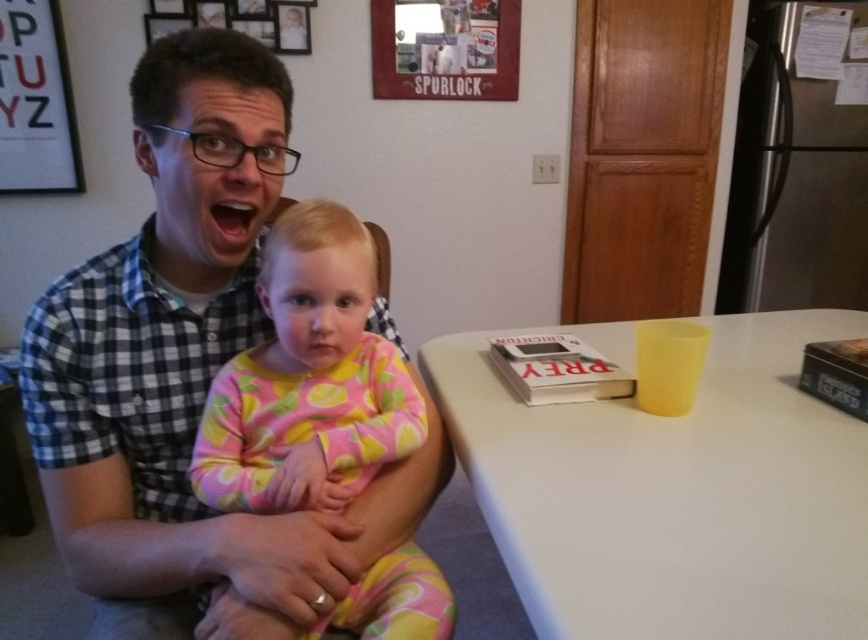
Question: Does checkered fabric shirt at upper left appear on the right side of white matte table at center?

Choices:
 (A) no
 (B) yes

Answer: (A)

Question: Which point appears farthest from the camera in this image?

Choices:
 (A) (84, 547)
 (B) (617, 483)
 (C) (301, 272)

Answer: (A)

Question: Which object is farther from the camera taking this photo?

Choices:
 (A) white matte table at center
 (B) checkered fabric shirt at upper left

Answer: (B)

Question: Is checkered fabric shirt at upper left wider than pink floral pajamas at center?

Choices:
 (A) yes
 (B) no

Answer: (A)

Question: Which point is farther from the camera taking this photo?

Choices:
 (A) (284, 552)
 (B) (336, 244)
 (C) (556, 504)

Answer: (B)

Question: Observing the image, what is the correct spatial positioning of white matte table at center in reference to pink floral pajamas at center?

Choices:
 (A) right
 (B) left

Answer: (A)